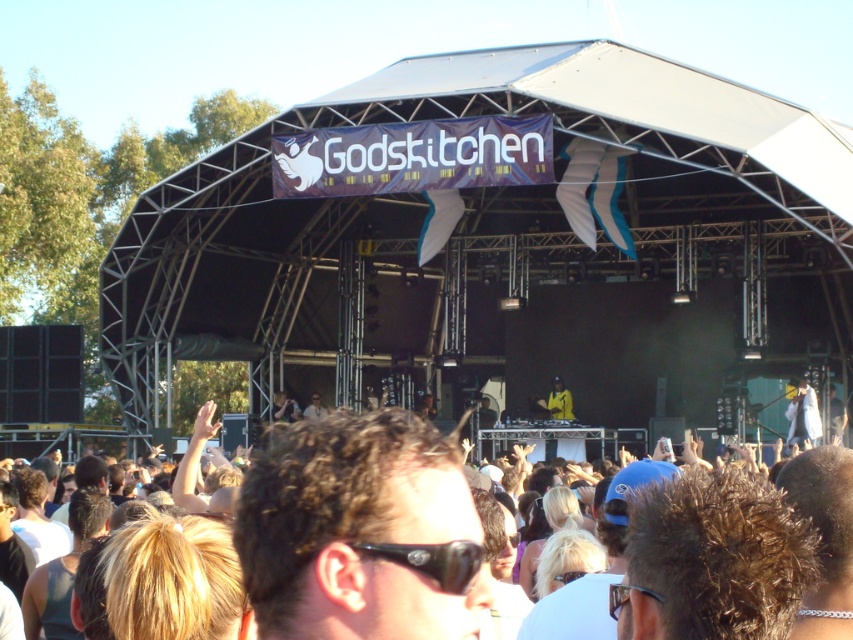
Is black plastic sunglasses at center thinner than light brown hair at center?

No, black plastic sunglasses at center is not thinner than light brown hair at center.

Does point (450, 557) come farther from viewer compared to point (312, 413)?

No, (450, 557) is in front of (312, 413).

At what (x,y) coordinates should I click in order to perform the action: click on black plastic sunglasses at center. Please return your answer as a coordinate pair (x, y). Looking at the image, I should click on (432, 561).

Does clear plastic glasses at center have a lesser width compared to light brown hair at center?

Yes.

Locate an element on the screen. This screenshot has height=640, width=853. clear plastic glasses at center is located at coordinates (625, 596).

Is point (608, 595) positioned after point (305, 410)?

No.

The height and width of the screenshot is (640, 853). I want to click on clear plastic glasses at center, so click(x=625, y=596).

Which is in front, point (416, 548) or point (608, 589)?

Positioned in front is point (416, 548).

Between black plastic sunglasses at center and clear plastic glasses at center, which one is positioned higher?

Positioned higher is black plastic sunglasses at center.

You are a GUI agent. You are given a task and a screenshot of the screen. Output one action in this format:
    pyautogui.click(x=<x>, y=<y>)
    Task: Click on the black plastic sunglasses at center
    This screenshot has width=853, height=640.
    Given the screenshot: What is the action you would take?
    pyautogui.click(x=432, y=561)